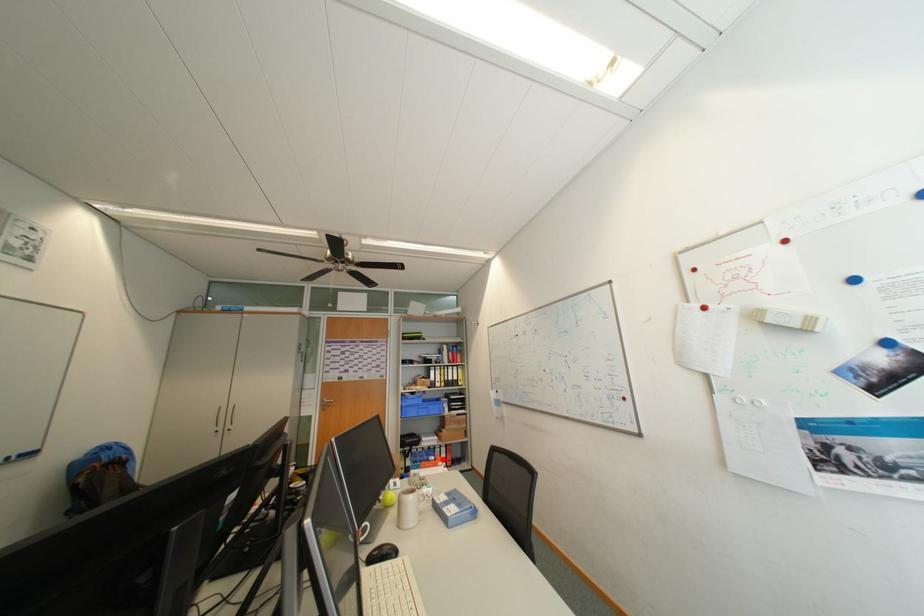
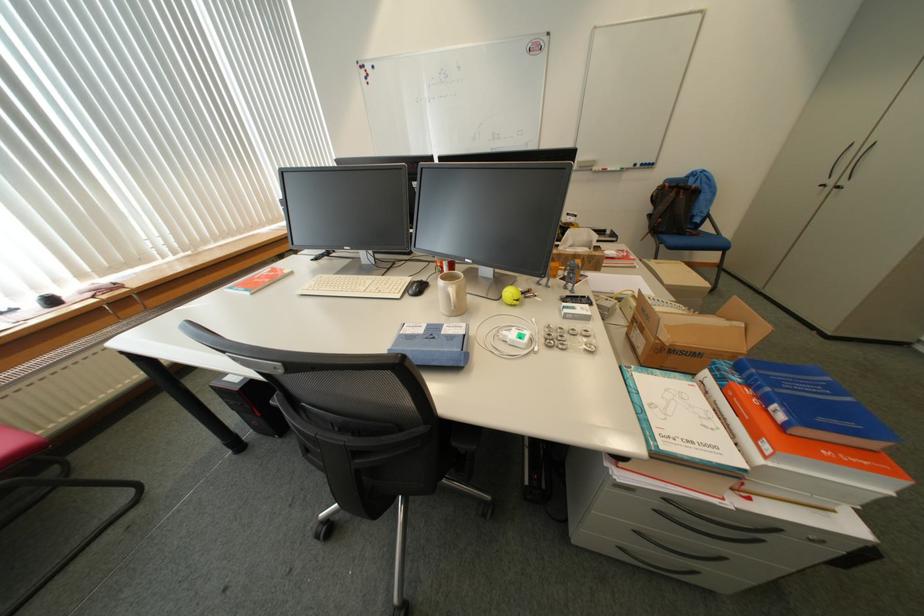
Question: I am providing you with two images of the same scene from different viewpoints. A red point is shown in image1. For the corresponding object point in image2, is it positioned nearer or farther from the camera?

Choices:
 (A) Nearer
 (B) Farther

Answer: (B)